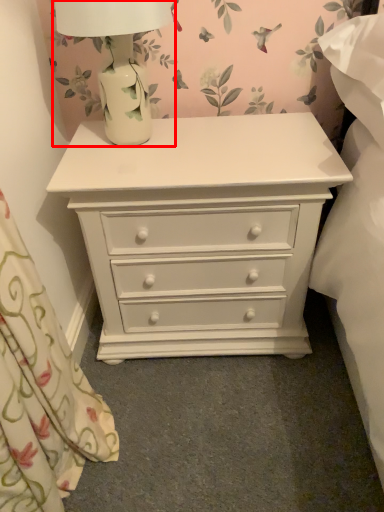
Question: From the image's perspective, considering the relative positions of table lamp (annotated by the red box) and chest of drawers in the image provided, where is table lamp (annotated by the red box) located with respect to the staircase?

Choices:
 (A) above
 (B) below

Answer: (A)